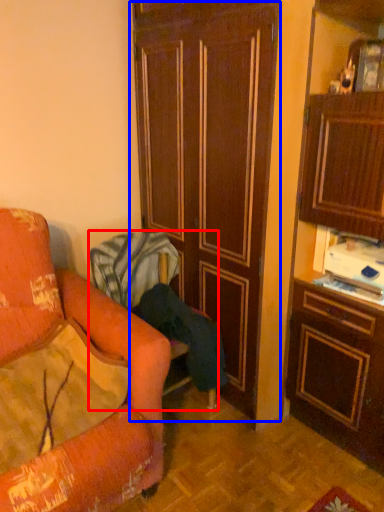
Question: Among these objects, which one is farthest to the camera, chair (highlighted by a red box) or door (highlighted by a blue box)?

Choices:
 (A) chair
 (B) door

Answer: (A)